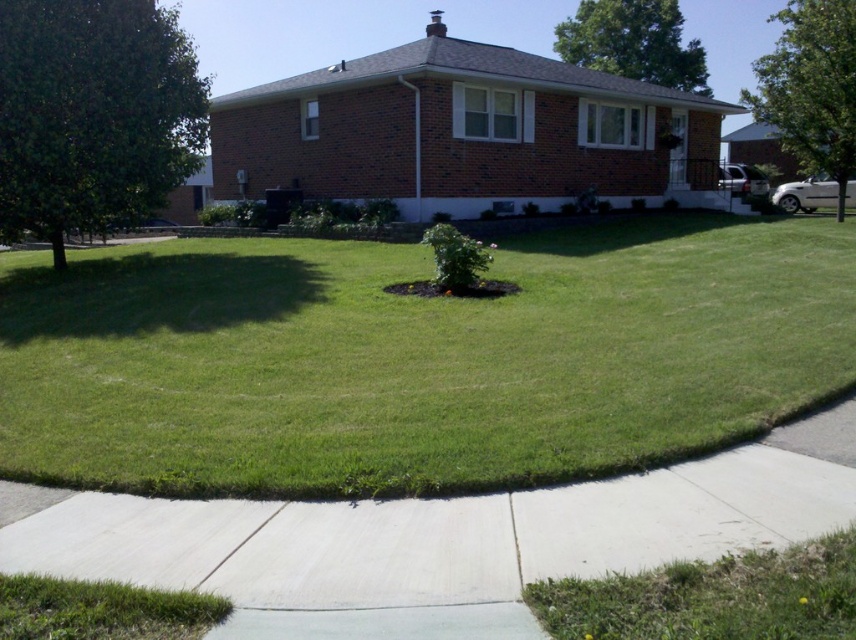
Question: In this image, where is green grass at lower right located relative to green leafy tree at right?

Choices:
 (A) right
 (B) left

Answer: (B)

Question: Which object is positioned closest to the green grass at center?

Choices:
 (A) green grass at lower left
 (B) green leafy tree at upper right
 (C) green leafy tree at right

Answer: (A)

Question: Which object is the closest to the green leafy tree at upper right?

Choices:
 (A) green grass at lower right
 (B) green leafy tree at left

Answer: (B)

Question: Considering the real-world distances, which object is closest to the green grass at lower left?

Choices:
 (A) green leafy tree at upper right
 (B) green leafy tree at left
 (C) green leafy tree at right

Answer: (B)

Question: Does green leafy tree at right appear on the left side of green leafy tree at upper right?

Choices:
 (A) yes
 (B) no

Answer: (B)

Question: In this image, where is green grass at center located relative to green leafy tree at right?

Choices:
 (A) right
 (B) left

Answer: (B)